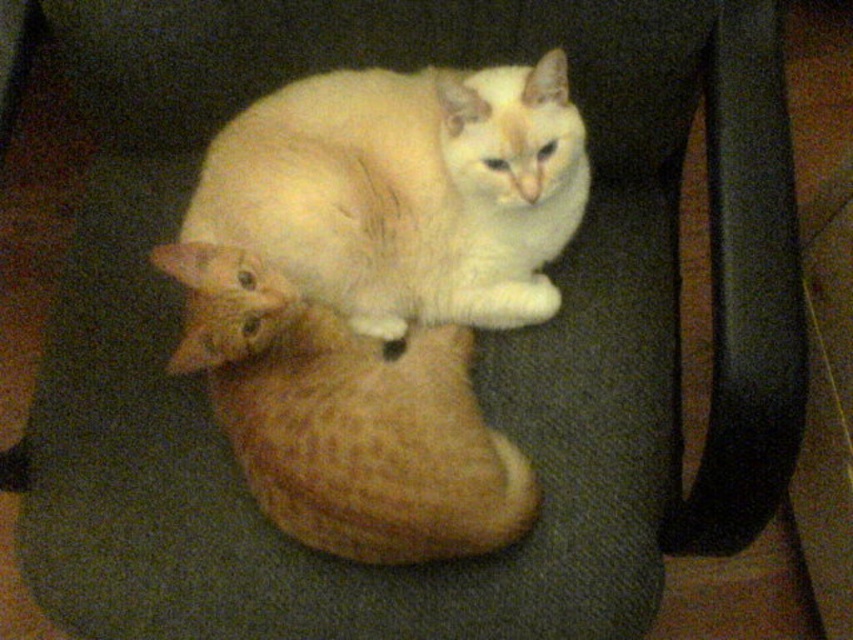
You are a cat owner who wants to place a cat tree between the two cats. The cat tree requires at least 30 cm of space between the cats to be placed safely. Can you determine if there is enough space between the soft cream fur cat at center and the white fluffy cat at center based on their sizes?

The soft cream fur cat at center is not as tall as the white fluffy cat at center, but the required space for the cat tree is 30 cm. Since the description only provides information about their heights and not the distance between them, it is impossible to determine if there is enough space to place the cat tree safely.

You are a photographer trying to capture a closeup of the soft cream fur cat at center and the white fluffy cat at center. Which cat should you focus on to ensure the subject is in sharp focus?

You should focus on the soft cream fur cat at center because it is closer to the viewer than the white fluffy cat at center, making it the primary subject for a closeup.

Based on the photo, you are a photographer trying to capture a photo of the two cats. Since the soft cream fur cat at center and the white fluffy cat at center are overlapping, which cat should you focus on to ensure the other is still visible in the background?

The soft cream fur cat at center is positioned over white fluffy cat at center, so focusing on the soft cream fur cat at center will keep the white fluffy cat at center visible in the background.